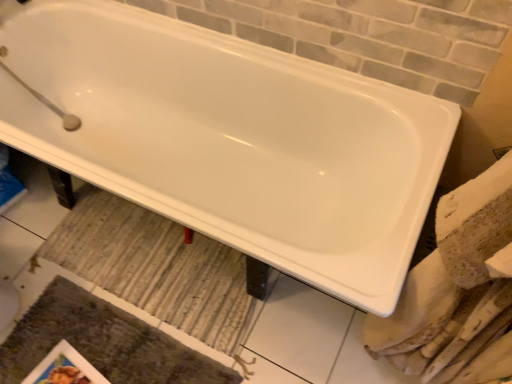
Question: Is matte paper magazine at lower left facing away from textured gray bath mat at lower left, which is the 1th bath mat in bottom-to-top order?

Choices:
 (A) yes
 (B) no

Answer: (A)

Question: Is the depth of matte paper magazine at lower left less than that of textured gray bath mat at lower left, placed as the 2th bath mat when sorted from top to bottom?

Choices:
 (A) no
 (B) yes

Answer: (A)

Question: Can you confirm if matte paper magazine at lower left is positioned to the left of textured gray bath mat at lower left, which is the 1th bath mat in bottom-to-top order?

Choices:
 (A) yes
 (B) no

Answer: (A)

Question: Does matte paper magazine at lower left have a greater height compared to textured gray bath mat at lower left, which is the 1th bath mat in bottom-to-top order?

Choices:
 (A) yes
 (B) no

Answer: (B)

Question: Can you confirm if matte paper magazine at lower left is shorter than textured gray bath mat at lower left, which is the 1th bath mat in bottom-to-top order?

Choices:
 (A) yes
 (B) no

Answer: (A)

Question: Based on their sizes in the image, would you say textured gray bath mat at lower left, which is the 1th bath mat in bottom-to-top order, is bigger or smaller than matte paper magazine at lower left?

Choices:
 (A) small
 (B) big

Answer: (B)

Question: From the image's perspective, is textured gray bath mat at lower left, which is the 1th bath mat in bottom-to-top order, located above or below matte paper magazine at lower left?

Choices:
 (A) below
 (B) above

Answer: (B)

Question: Considering the positions of textured gray bath mat at lower left, which is the 1th bath mat in bottom-to-top order, and matte paper magazine at lower left in the image, is textured gray bath mat at lower left, which is the 1th bath mat in bottom-to-top order, taller or shorter than matte paper magazine at lower left?

Choices:
 (A) short
 (B) tall

Answer: (B)

Question: Is textured gray bath mat at lower left, placed as the 2th bath mat when sorted from top to bottom, to the left or to the right of matte paper magazine at lower left in the image?

Choices:
 (A) left
 (B) right

Answer: (B)

Question: In the image, is matte paper magazine at lower left on the left side or the right side of striped fabric bath mat at center, the 1th bath mat when ordered from top to bottom?

Choices:
 (A) right
 (B) left

Answer: (B)

Question: Would you say matte paper magazine at lower left is inside or outside striped fabric bath mat at center, the second bath mat positioned from the bottom?

Choices:
 (A) inside
 (B) outside

Answer: (B)

Question: Is point (45, 375) closer or farther from the camera than point (113, 205)?

Choices:
 (A) closer
 (B) farther

Answer: (A)

Question: Considering the positions of matte paper magazine at lower left and striped fabric bath mat at center, the second bath mat positioned from the bottom, in the image, is matte paper magazine at lower left wider or thinner than striped fabric bath mat at center, the second bath mat positioned from the bottom,?

Choices:
 (A) thin
 (B) wide

Answer: (A)

Question: Would you say striped fabric bath mat at center, the second bath mat positioned from the bottom, is inside or outside matte paper magazine at lower left?

Choices:
 (A) outside
 (B) inside

Answer: (A)

Question: Looking at their shapes, would you say striped fabric bath mat at center, the second bath mat positioned from the bottom, is wider or thinner than matte paper magazine at lower left?

Choices:
 (A) thin
 (B) wide

Answer: (B)